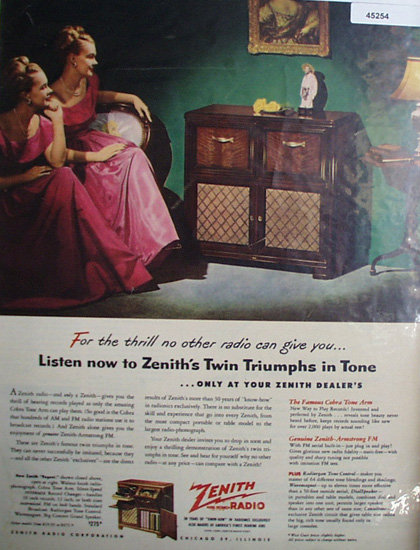
I want to click on wall, so click(x=223, y=76).